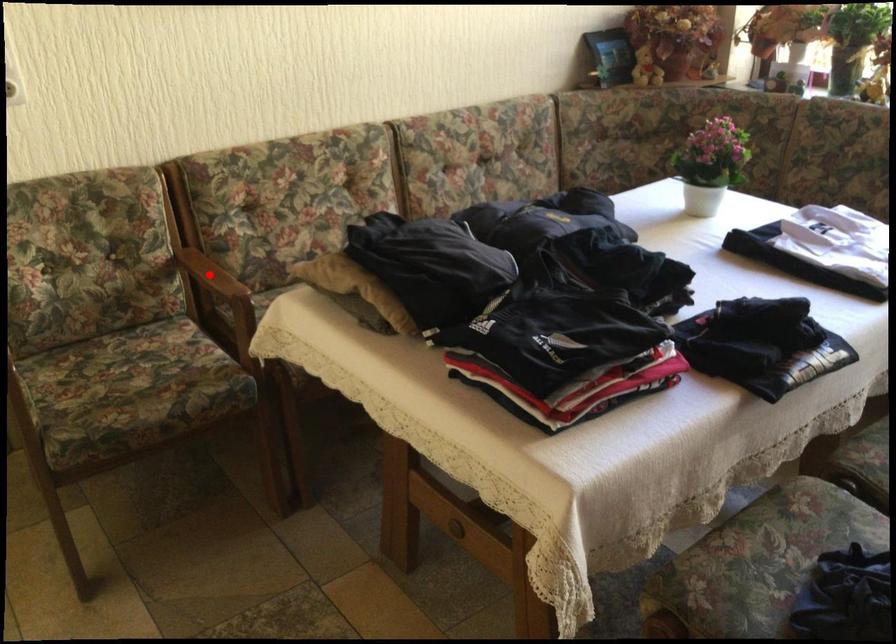
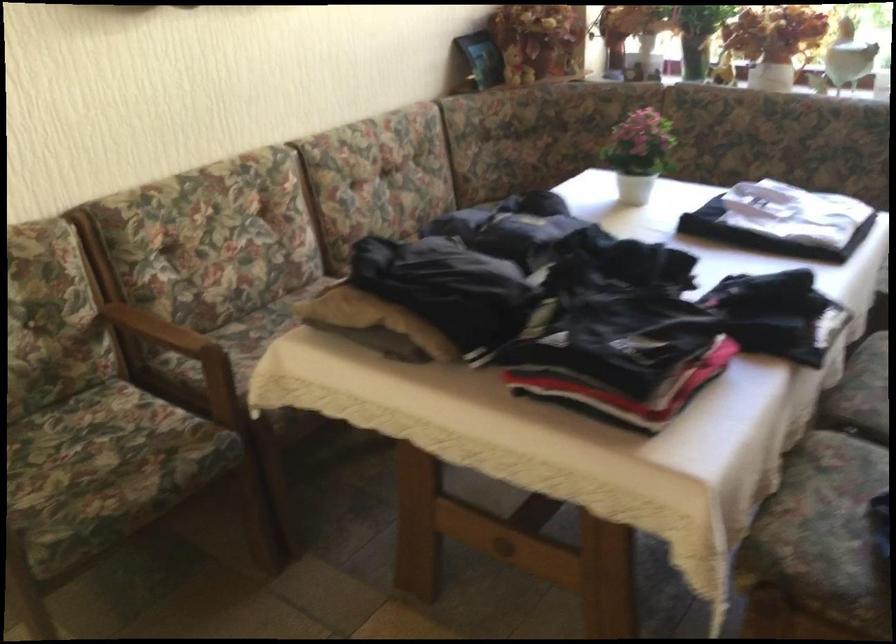
In the second image, find the point that corresponds to the highlighted location in the first image.

(158, 328)